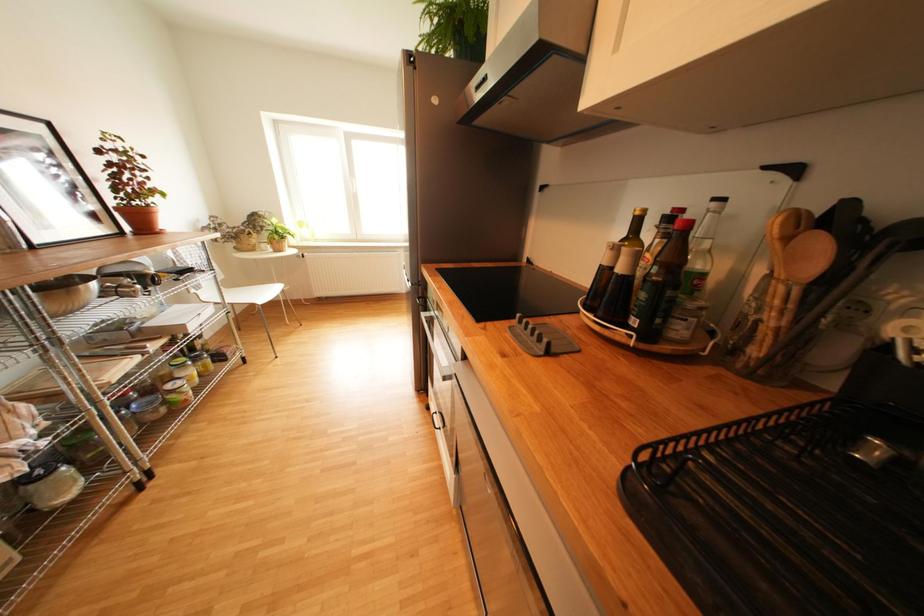
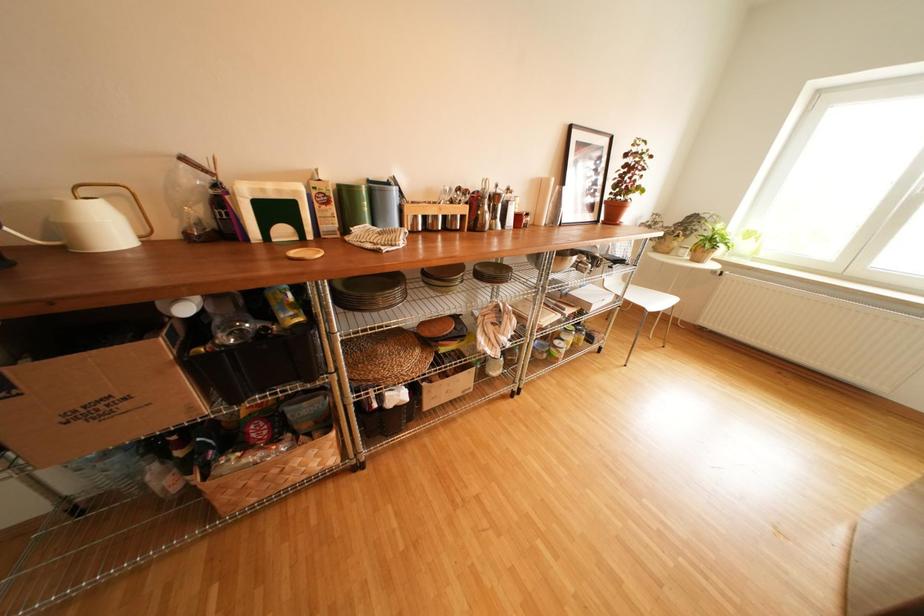
How did the camera likely rotate?

The camera rotated toward left-down.